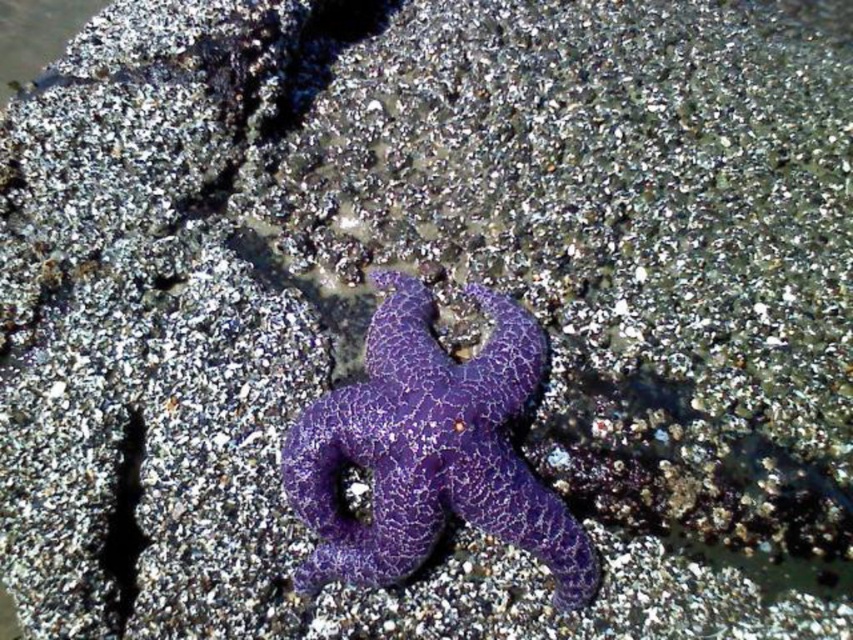
Question: Which of the following is the farthest from the observer?

Choices:
 (A) clear water at upper left
 (B) purple cracked starfish at center

Answer: (A)

Question: Does purple cracked starfish at center appear on the right side of clear water at upper left?

Choices:
 (A) no
 (B) yes

Answer: (B)

Question: Is purple cracked starfish at center above clear water at upper left?

Choices:
 (A) yes
 (B) no

Answer: (B)

Question: Does purple cracked starfish at center have a larger size compared to clear water at upper left?

Choices:
 (A) yes
 (B) no

Answer: (A)

Question: Which object is closer to the camera taking this photo?

Choices:
 (A) clear water at upper left
 (B) purple cracked starfish at center

Answer: (B)